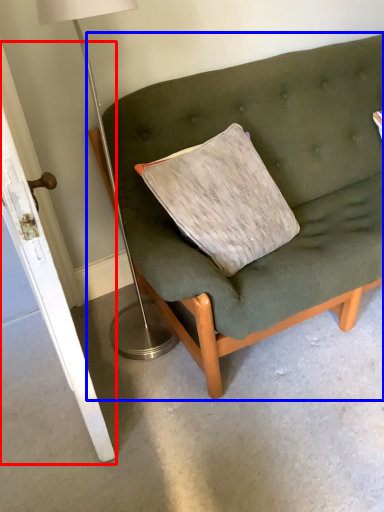
Question: Which point is further to the camera, door (highlighted by a red box) or studio couch (highlighted by a blue box)?

Choices:
 (A) door
 (B) studio couch

Answer: (B)